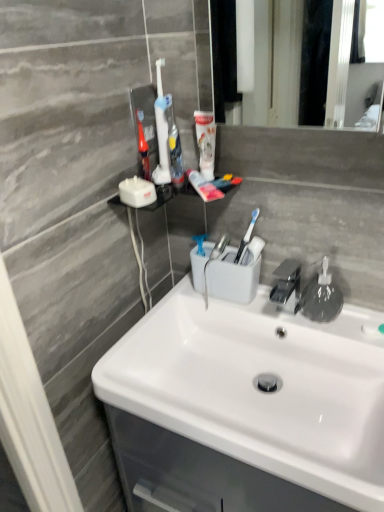
Question: From a real-world perspective, is translucent plastic toothbrush at upper center, which ranks as the 3th toothbrush in right-to-left order, located beneath white plastic toothbrush at upper center, the first toothbrush when ordered from right to left?

Choices:
 (A) no
 (B) yes

Answer: (B)

Question: Can you confirm if translucent plastic toothbrush at upper center, the 1th toothbrush when ordered from left to right, is wider than white plastic toothbrush at upper center, the first toothbrush when ordered from right to left?

Choices:
 (A) no
 (B) yes

Answer: (A)

Question: Is translucent plastic toothbrush at upper center, the 1th toothbrush when ordered from left to right, shorter than white plastic toothbrush at upper center, placed as the third toothbrush when sorted from left to right?

Choices:
 (A) yes
 (B) no

Answer: (A)

Question: Is white plastic toothbrush at upper center, the first toothbrush when ordered from right to left, located within translucent plastic toothbrush at upper center, which ranks as the 3th toothbrush in right-to-left order?

Choices:
 (A) no
 (B) yes

Answer: (A)

Question: Is translucent plastic toothbrush at upper center, the 1th toothbrush when ordered from left to right, oriented towards white plastic toothbrush at upper center, the first toothbrush when ordered from right to left?

Choices:
 (A) yes
 (B) no

Answer: (B)

Question: Is transparent plastic soap dispenser at right to the left or to the right of translucent plastic toothbrush at upper center, which ranks as the 3th toothbrush in right-to-left order, in the image?

Choices:
 (A) left
 (B) right

Answer: (B)

Question: From their relative heights in the image, would you say transparent plastic soap dispenser at right is taller or shorter than translucent plastic toothbrush at upper center, the 1th toothbrush when ordered from left to right?

Choices:
 (A) tall
 (B) short

Answer: (A)

Question: From a real-world perspective, is transparent plastic soap dispenser at right positioned above or below translucent plastic toothbrush at upper center, the 1th toothbrush when ordered from left to right?

Choices:
 (A) above
 (B) below

Answer: (B)

Question: From the image's perspective, relative to translucent plastic toothbrush at upper center, the 1th toothbrush when ordered from left to right, is transparent plastic soap dispenser at right above or below?

Choices:
 (A) above
 (B) below

Answer: (B)

Question: Choose the correct answer: Is white glossy sink at center inside translucent plastic toothbrush at upper center, which ranks as the 3th toothbrush in right-to-left order, or outside it?

Choices:
 (A) outside
 (B) inside

Answer: (A)

Question: Does point (253, 336) appear closer or farther from the camera than point (135, 113)?

Choices:
 (A) farther
 (B) closer

Answer: (A)

Question: From the image's perspective, is white glossy sink at center positioned above or below translucent plastic toothbrush at upper center, the 1th toothbrush when ordered from left to right?

Choices:
 (A) below
 (B) above

Answer: (A)

Question: From a real-world perspective, is white glossy sink at center positioned above or below translucent plastic toothbrush at upper center, which ranks as the 3th toothbrush in right-to-left order?

Choices:
 (A) above
 (B) below

Answer: (B)

Question: Is white glossy sink at center inside the boundaries of transparent plastic soap dispenser at right, or outside?

Choices:
 (A) inside
 (B) outside

Answer: (B)

Question: Is white glossy sink at center in front of or behind transparent plastic soap dispenser at right in the image?

Choices:
 (A) behind
 (B) front

Answer: (B)